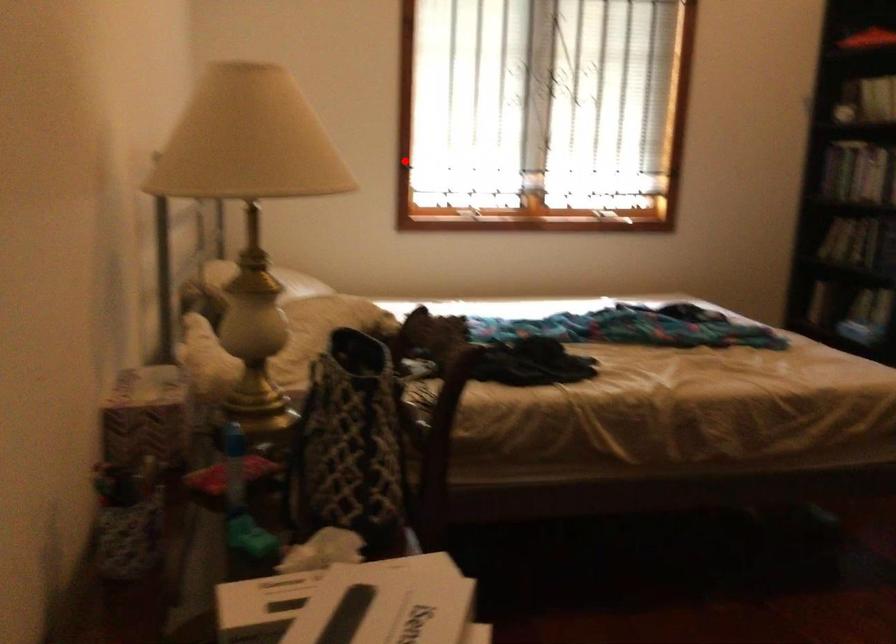
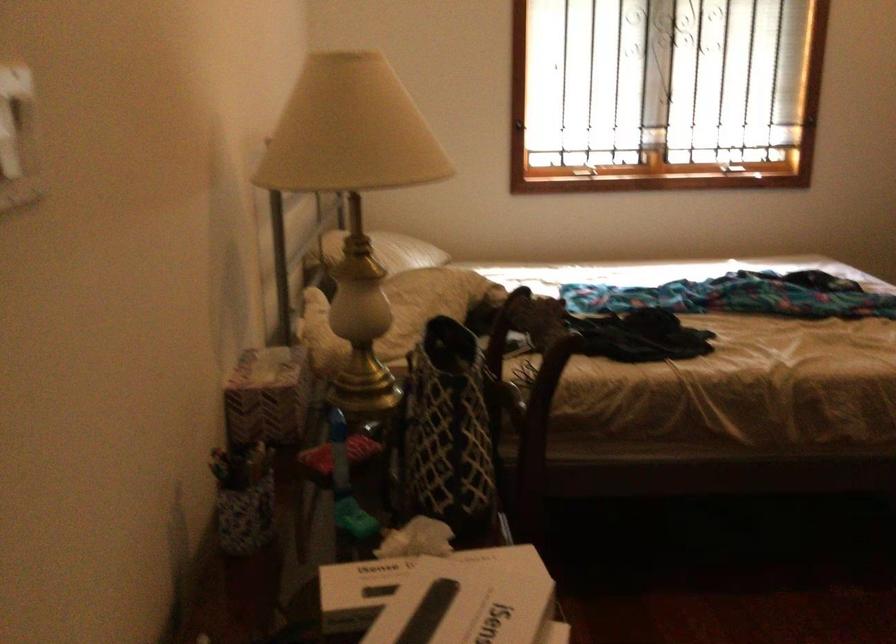
In the second image, find the point that corresponds to the highlighted location in the first image.

(520, 124)